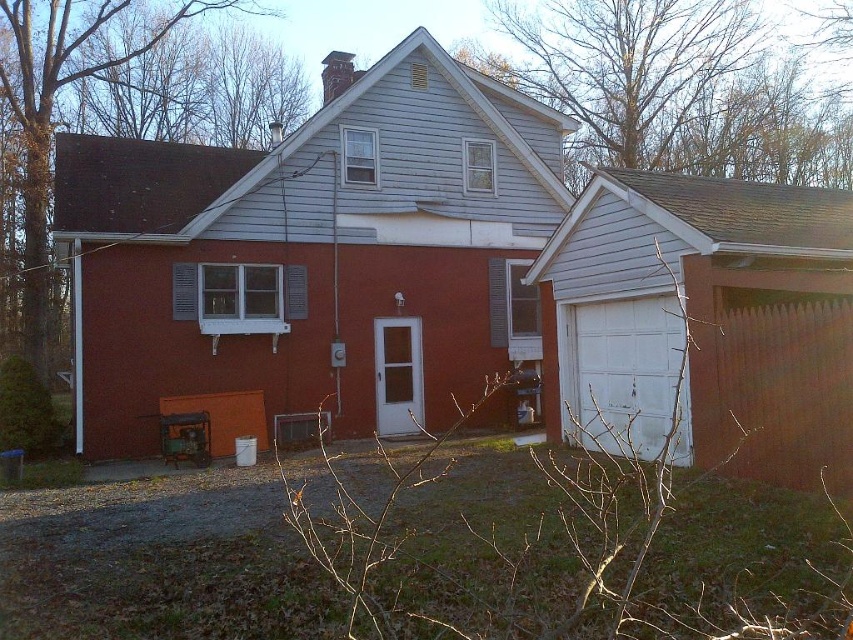
Is smooth red shed at center shorter than white matte garage door at right?

In fact, smooth red shed at center may be taller than white matte garage door at right.

Is smooth red shed at center thinner than white matte garage door at right?

Incorrect, smooth red shed at center's width is not less than white matte garage door at right's.

Locate an element on the screen. This screenshot has height=640, width=853. smooth red shed at center is located at coordinates (312, 253).